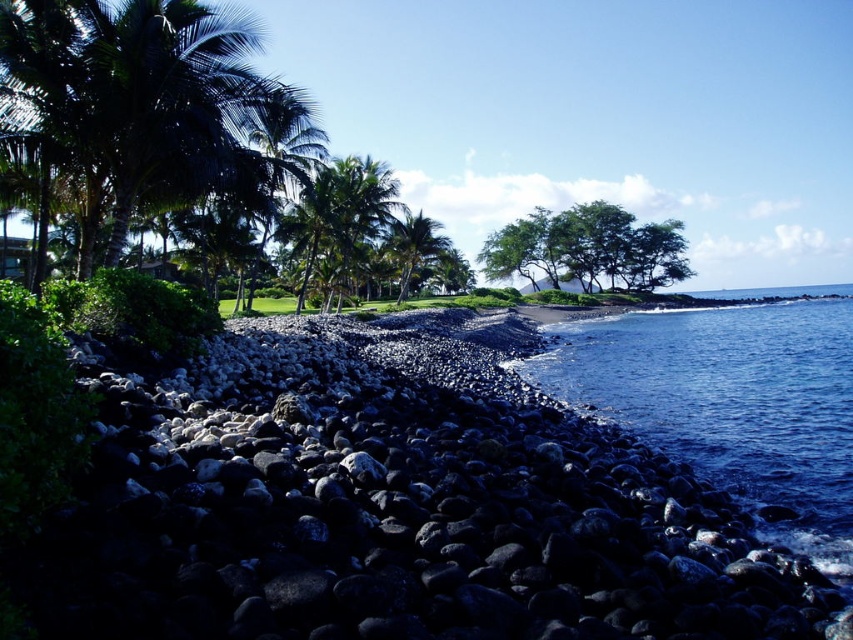
Is green leafy palm tree at upper left above green leafy palm tree at center?

No, green leafy palm tree at upper left is not above green leafy palm tree at center.

Is point (68, 45) positioned in front of point (427, 240)?

Yes, it is.

Find the location of `green leafy palm tree at upper left`. green leafy palm tree at upper left is located at coordinates (131, 99).

Does point (660, 268) lie in front of point (407, 216)?

No, it is not.

Which is more to the left, green leafy trees at center or green leafy palm tree at center?

Positioned to the left is green leafy palm tree at center.

Which is in front, point (556, 253) or point (387, 230)?

Point (387, 230) is in front.

The height and width of the screenshot is (640, 853). Find the location of `green leafy trees at center`. green leafy trees at center is located at coordinates (589, 248).

Is black volcanic rocks at lower left positioned before green leafy palm tree at upper left?

Yes, it is in front of green leafy palm tree at upper left.

Who is lower down, black volcanic rocks at lower left or green leafy palm tree at upper left?

black volcanic rocks at lower left

Is point (312, 552) in front of point (192, 129)?

Yes, point (312, 552) is in front of point (192, 129).

Where is `black volcanic rocks at lower left`? The width and height of the screenshot is (853, 640). black volcanic rocks at lower left is located at coordinates (399, 502).